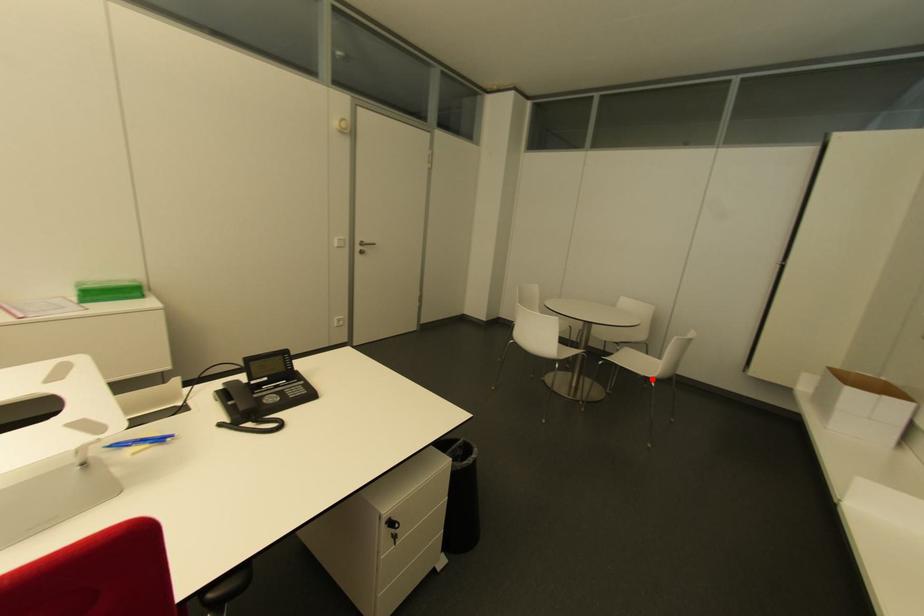
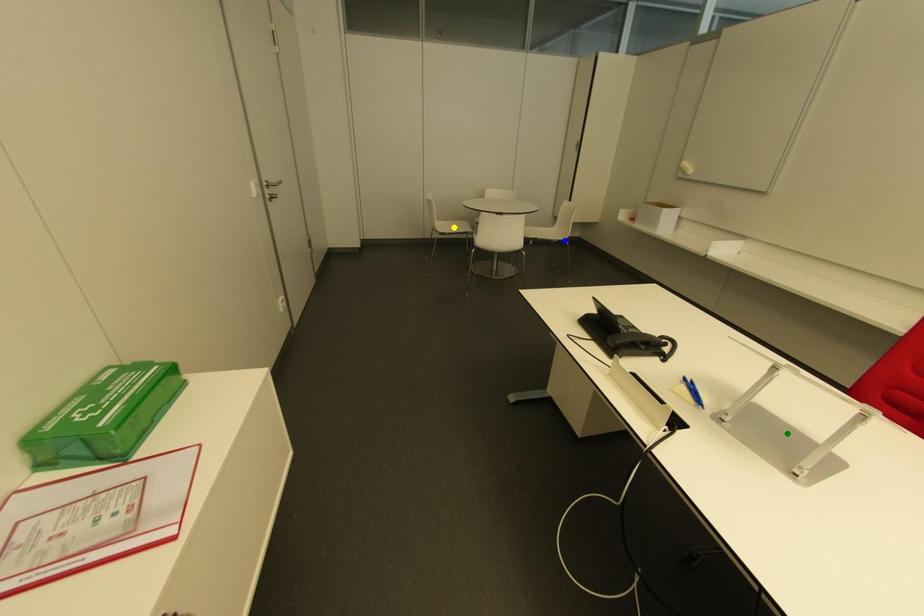
Question: I am providing you with two images of the same scene from different viewpoints. A red point is marked on the first image. You are given multiple points on the second image. Which spot in image 2 lines up with the point in image 1?

Choices:
 (A) yellow point
 (B) blue point
 (C) green point

Answer: (B)